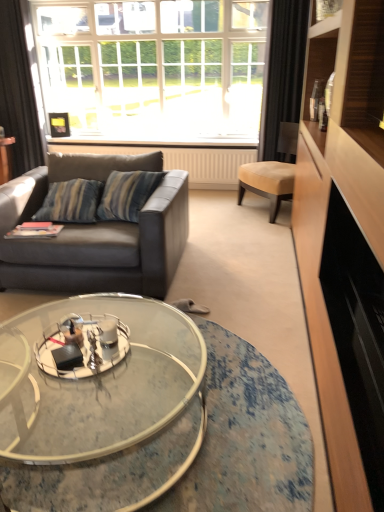
You are a GUI agent. You are given a task and a screenshot of the screen. Output one action in this format:
    pyautogui.click(x=<x>, y=<y>)
    Task: Click on the dark gray fabric curtain at left, marked as the 1th curtain in a left-to-right arrangement
    
    Given the screenshot: What is the action you would take?
    pyautogui.click(x=18, y=91)

You are a GUI agent. You are given a task and a screenshot of the screen. Output one action in this format:
    pyautogui.click(x=<x>, y=<y>)
    Task: Click on the clear glass coffee table at center
    The height and width of the screenshot is (512, 384).
    Given the screenshot: What is the action you would take?
    pyautogui.click(x=99, y=404)

In the scene shown: What is the approximate width of clear glass coffee table at center?

It is 4.08 feet.

This screenshot has width=384, height=512. In order to click on suede-like tan chair at right in this screenshot , I will do `click(272, 172)`.

From a real-world perspective, is clear glass window at upper center physically located above or below matte gray leather couch at left?

From a real-world perspective, clear glass window at upper center is physically above matte gray leather couch at left.

Is clear glass window at upper center surrounding matte gray leather couch at left?

No.

Are clear glass window at upper center and matte gray leather couch at left far apart?

Yes, clear glass window at upper center is far from matte gray leather couch at left.

Measure the distance from wooden cabinet at right to dark gray fabric curtain at left, marked as the 1th curtain in a left-to-right arrangement.

They are 4.14 meters apart.

Would you say wooden cabinet at right is a long distance from dark gray fabric curtain at left, marked as the 1th curtain in a left-to-right arrangement?

Indeed, wooden cabinet at right is not near dark gray fabric curtain at left, marked as the 1th curtain in a left-to-right arrangement.

From a real-world perspective, between wooden cabinet at right and dark gray fabric curtain at left, which appears as the second curtain when viewed from the right, who is vertically lower?

wooden cabinet at right is physically lower.

Is wooden cabinet at right inside or outside of dark gray fabric curtain at left, which appears as the second curtain when viewed from the right?

wooden cabinet at right is not enclosed by dark gray fabric curtain at left, which appears as the second curtain when viewed from the right.

Is black fabric curtain at upper right, the first curtain in the right-to-left sequence, looking in the opposite direction of clear glass window at upper center?

Yes.

From the picture: Are black fabric curtain at upper right, the first curtain in the right-to-left sequence, and clear glass window at upper center beside each other?

No, black fabric curtain at upper right, the first curtain in the right-to-left sequence, is not touching clear glass window at upper center.

Locate an element on the screen. Image resolution: width=384 pixels, height=512 pixels. curtain in front of the clear glass window at upper center is located at coordinates click(x=282, y=71).

Does point (111, 239) come farther from viewer compared to point (107, 146)?

No, (111, 239) is in front of (107, 146).

The height and width of the screenshot is (512, 384). In order to click on radiator that is under the matte gray leather couch at left (from a real-world perspective) in this screenshot , I will do `click(182, 161)`.

Is matte gray leather couch at left looking in the opposite direction of white textured radiator at center?

That's right, matte gray leather couch at left is facing away from white textured radiator at center.

From the picture: Is matte gray leather couch at left inside or outside of white textured radiator at center?

matte gray leather couch at left is outside white textured radiator at center.

From the image's perspective, which is below, dark gray fabric curtain at left, marked as the 1th curtain in a left-to-right arrangement, or matte gray leather couch at left?

From the image's view, matte gray leather couch at left is below.

Considering the relative positions of dark gray fabric curtain at left, which appears as the second curtain when viewed from the right, and matte gray leather couch at left in the image provided, is dark gray fabric curtain at left, which appears as the second curtain when viewed from the right, to the right of matte gray leather couch at left from the viewer's perspective?

No, dark gray fabric curtain at left, which appears as the second curtain when viewed from the right, is not to the right of matte gray leather couch at left.

From a real-world perspective, which is physically below, dark gray fabric curtain at left, which appears as the second curtain when viewed from the right, or matte gray leather couch at left?

From a 3D spatial view, matte gray leather couch at left is below.

Is white textured radiator at center at the right side of suede-like tan chair at right?

In fact, white textured radiator at center is to the left of suede-like tan chair at right.

Does white textured radiator at center touch suede-like tan chair at right?

white textured radiator at center and suede-like tan chair at right are not in contact.

Is white textured radiator at center wider than suede-like tan chair at right?

No.

Which is farther from the camera, (211, 169) or (241, 180)?

The point (211, 169) is more distant.

Is matte gray leather couch at left facing towards clear glass window at upper center?

No, matte gray leather couch at left does not turn towards clear glass window at upper center.

Consider the image. Considering the sizes of objects matte gray leather couch at left and clear glass window at upper center in the image provided, who is shorter, matte gray leather couch at left or clear glass window at upper center?

matte gray leather couch at left.

You are a GUI agent. You are given a task and a screenshot of the screen. Output one action in this format:
    pyautogui.click(x=<x>, y=<y>)
    Task: Click on the window above the matte gray leather couch at left (from a real-world perspective)
    The width and height of the screenshot is (384, 512).
    Given the screenshot: What is the action you would take?
    pyautogui.click(x=154, y=68)

Locate an element on the screen. The height and width of the screenshot is (512, 384). curtain on the left of wooden cabinet at right is located at coordinates (18, 91).

Consider the image. When comparing their distances from white textured radiator at center, does wooden cabinet at right or clear glass window at upper center seem further?

clear glass window at upper center.

Considering their positions, is white textured radiator at center positioned closer to wooden cabinet at right than clear glass coffee table at center?

clear glass coffee table at center lies closer to wooden cabinet at right than the other object.

From the image, which object appears to be farther from matte gray leather couch at left, clear glass coffee table at center or white textured radiator at center?

Among the two, white textured radiator at center is located further to matte gray leather couch at left.

Considering their positions, is wooden cabinet at right positioned closer to black fabric curtain at upper right, which is the 2th curtain from left to right, than matte gray leather couch at left?

The object closer to black fabric curtain at upper right, which is the 2th curtain from left to right, is wooden cabinet at right.

From the image, which object appears to be farther from wooden cabinet at right, black fabric curtain at upper right, which is the 2th curtain from left to right, or white textured radiator at center?

white textured radiator at center.

Considering their positions, is clear glass window at upper center positioned further to clear glass coffee table at center than matte gray leather couch at left?

The object further to clear glass coffee table at center is clear glass window at upper center.

When comparing their distances from matte gray leather couch at left, does clear glass window at upper center or dark gray fabric curtain at left, marked as the 1th curtain in a left-to-right arrangement, seem further?

Based on the image, clear glass window at upper center appears to be further to matte gray leather couch at left.

Considering their positions, is white textured radiator at center positioned further to clear glass window at upper center than matte gray leather couch at left?

matte gray leather couch at left lies further to clear glass window at upper center than the other object.

Locate an element on the screen. chair between clear glass window at upper center and black fabric curtain at upper right, which is the 2th curtain from left to right is located at coordinates (272, 172).

At what (x,y) coordinates should I click in order to perform the action: click on curtain between matte gray leather couch at left and clear glass window at upper center along the z-axis. Please return your answer as a coordinate pair (x, y). This screenshot has width=384, height=512. Looking at the image, I should click on (282, 71).

The height and width of the screenshot is (512, 384). Find the location of `window located between wooden cabinet at right and dark gray fabric curtain at left, which appears as the second curtain when viewed from the right, in the depth direction`. window located between wooden cabinet at right and dark gray fabric curtain at left, which appears as the second curtain when viewed from the right, in the depth direction is located at coordinates (154, 68).

Identify the location of chair between clear glass coffee table at center and white textured radiator at center from front to back. The width and height of the screenshot is (384, 512). (272, 172).